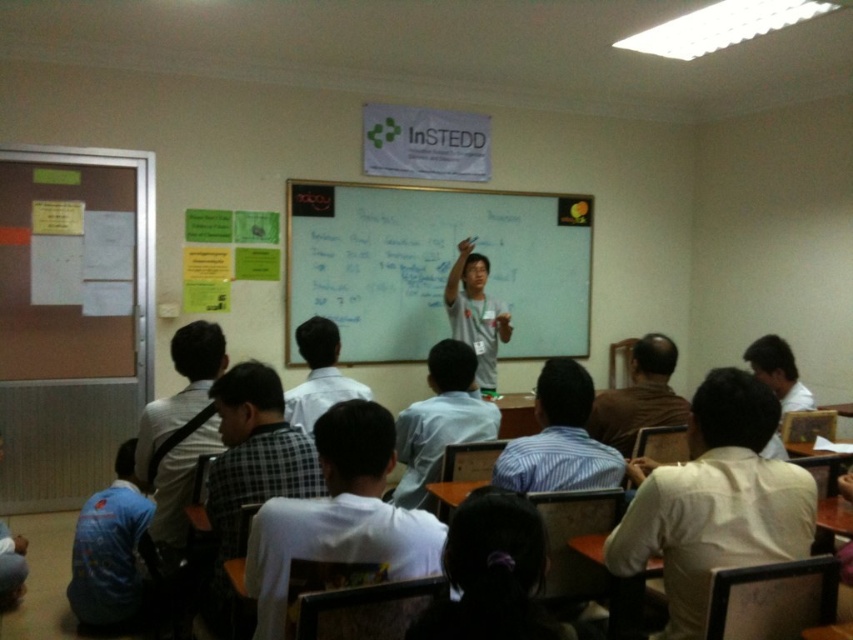
Who is more distant from viewer, (523, 355) or (569, 371)?

Point (523, 355)

Is point (374, 289) positioned before point (543, 444)?

No, it is behind (543, 444).

At what (x,y) coordinates should I click in order to perform the action: click on whiteboard at center. Please return your answer as a coordinate pair (x, y). The height and width of the screenshot is (640, 853). Looking at the image, I should click on click(434, 266).

Is whiteboard at center smaller than gray cotton shirt at center?

No, whiteboard at center is not smaller than gray cotton shirt at center.

Does whiteboard at center have a larger size compared to gray cotton shirt at center?

Indeed, whiteboard at center has a larger size compared to gray cotton shirt at center.

This screenshot has width=853, height=640. I want to click on whiteboard at center, so click(434, 266).

Can you confirm if striped shirt at center is positioned below gray cotton shirt at center?

Correct, striped shirt at center is located below gray cotton shirt at center.

Is point (572, 364) positioned behind point (479, 276)?

No, it is not.

Where is `striped shirt at center`? The width and height of the screenshot is (853, 640). striped shirt at center is located at coordinates (560, 438).